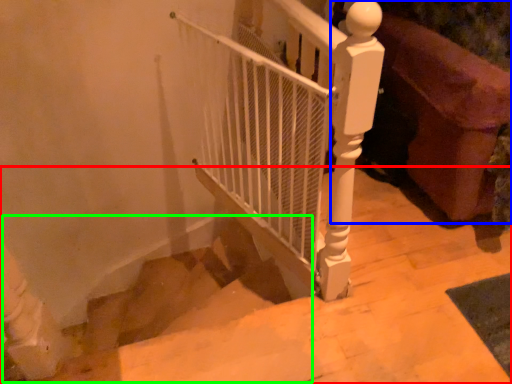
Question: Estimate the real-world distances between objects in this image. Which object is closer to stairs (highlighted by a red box), furniture (highlighted by a blue box) or stairwell (highlighted by a green box)?

Choices:
 (A) furniture
 (B) stairwell

Answer: (A)